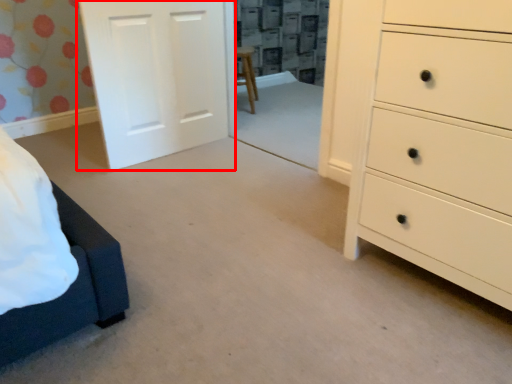
Question: From the image's perspective, what is the correct spatial relationship of door (annotated by the red box) in relation to chest of drawers?

Choices:
 (A) above
 (B) below

Answer: (A)